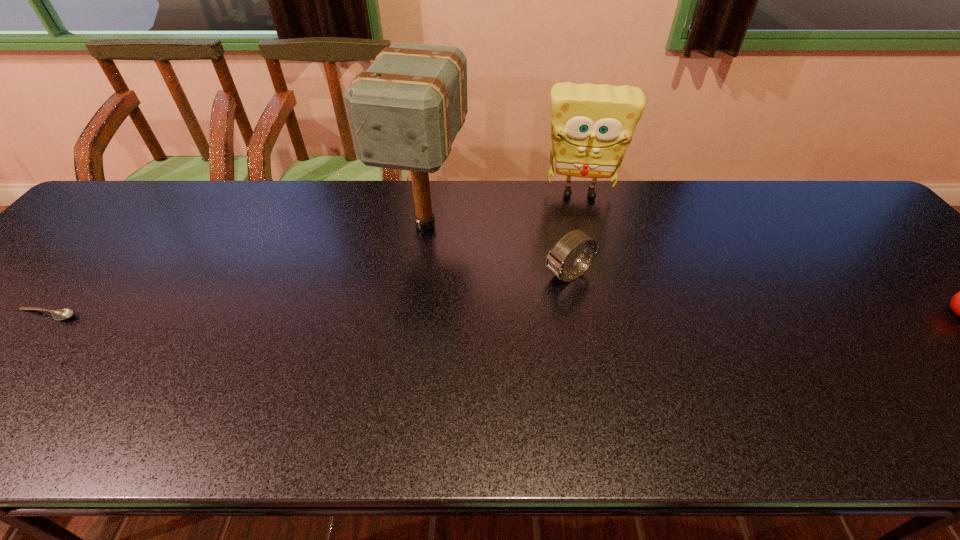
Locate an element on the screen. Image resolution: width=960 pixels, height=540 pixels. free space located on the face of the watch is located at coordinates (402, 360).

Identify the location of vacant region located on the face of the watch. (481, 319).

Find the location of a particular element. blank area located on the face of the watch is located at coordinates (431, 345).

The image size is (960, 540). I want to click on vacant region located on the face of the sponge, so click(579, 247).

At what (x,y) coordinates should I click in order to perform the action: click on free space located on the face of the sponge. Please return your answer as a coordinate pair (x, y). Looking at the image, I should click on (579, 240).

The image size is (960, 540). Find the location of `free space located 0.150m on the face of the sponge`. free space located 0.150m on the face of the sponge is located at coordinates (579, 240).

Find the location of a particular element. This screenshot has height=540, width=960. mallet that is positioned at the far edge is located at coordinates (405, 110).

Locate an element on the screen. sponge that is at the far edge is located at coordinates (592, 125).

The image size is (960, 540). Find the location of `object present at the left edge`. object present at the left edge is located at coordinates (62, 314).

Find the location of a particular element. This screenshot has width=960, height=540. vacant area at the far edge of the desktop is located at coordinates (372, 201).